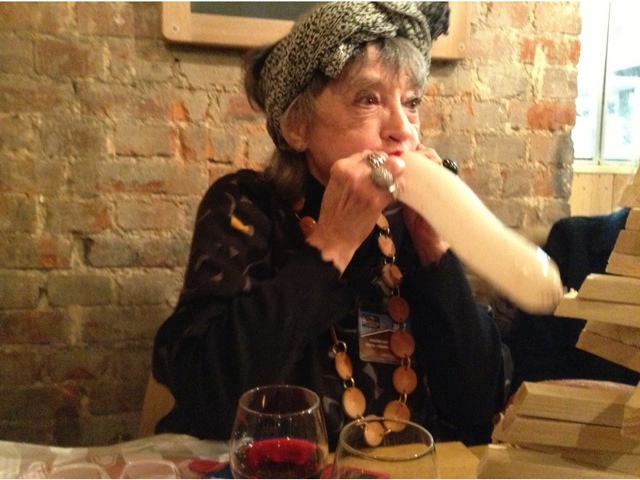
Locate an element on the screen. Image resolution: width=640 pixels, height=480 pixels. wine glasses is located at coordinates (368, 437), (271, 422).